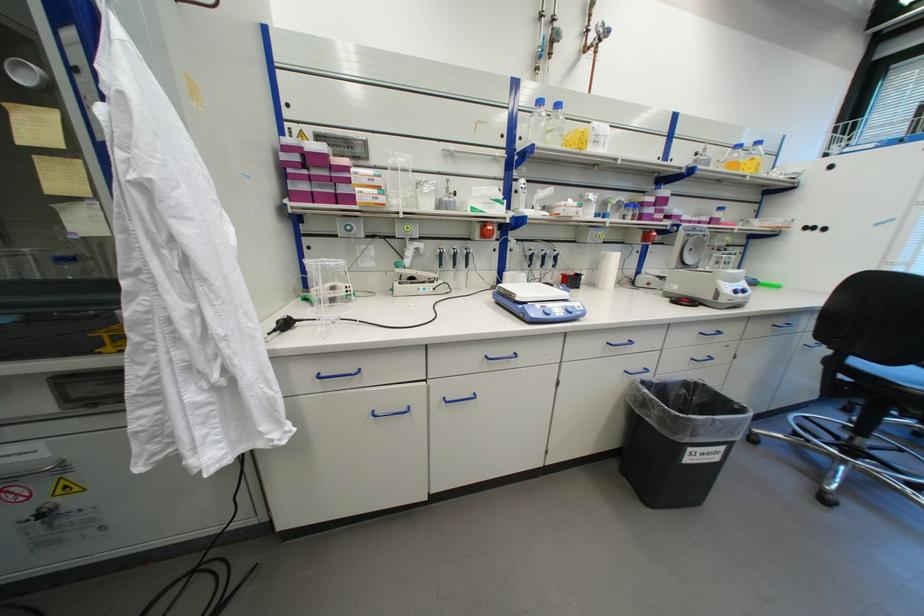
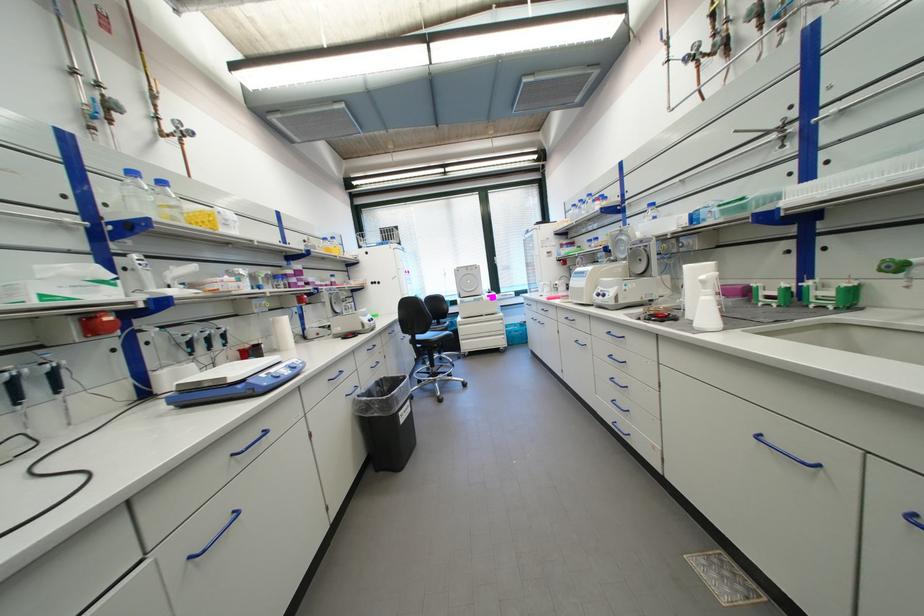
The point at (x=698, y=450) is marked in the first image. Where is the corresponding point in the second image?

(407, 415)